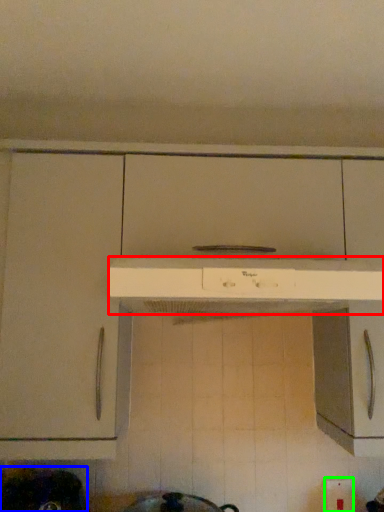
Question: Considering the real-world distances, which object is farthest from home appliance (highlighted by a red box)? appliance (highlighted by a blue box) or electric outlet (highlighted by a green box)?

Choices:
 (A) appliance
 (B) electric outlet

Answer: (B)